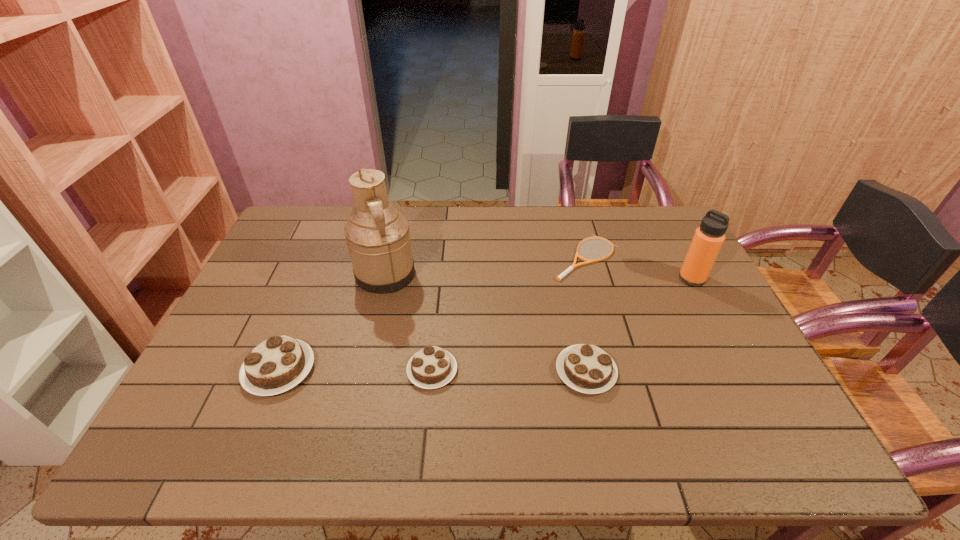
In order to click on free space located on the back of the leftmost chocolate cake in this screenshot , I will do `click(326, 254)`.

The height and width of the screenshot is (540, 960). I want to click on vacant region located on the right of the second shortest object, so click(582, 370).

Locate an element on the screen. The height and width of the screenshot is (540, 960). free space located on the right of the third shortest object is located at coordinates (756, 372).

Find the location of `vacant space located on the left of the tallest object`. vacant space located on the left of the tallest object is located at coordinates (298, 274).

You are a GUI agent. You are given a task and a screenshot of the screen. Output one action in this format:
    pyautogui.click(x=<x>, y=<y>)
    Task: Click on the free point located 0.220m on the front of the tennis racket
    The width and height of the screenshot is (960, 540).
    Given the screenshot: What is the action you would take?
    pyautogui.click(x=609, y=338)

Find the location of `vacant region located 0.350m on the back of the rightmost object`. vacant region located 0.350m on the back of the rightmost object is located at coordinates (655, 208).

At what (x,y) coordinates should I click in order to perform the action: click on object that is positioned at the far edge. Please return your answer as a coordinate pair (x, y). Looking at the image, I should click on (574, 265).

This screenshot has width=960, height=540. In order to click on object at the left edge in this screenshot , I will do `click(279, 363)`.

Locate an element on the screen. object located in the right edge section of the desktop is located at coordinates (708, 239).

Locate an element on the screen. This screenshot has width=960, height=540. object that is positioned at the near left corner is located at coordinates (279, 363).